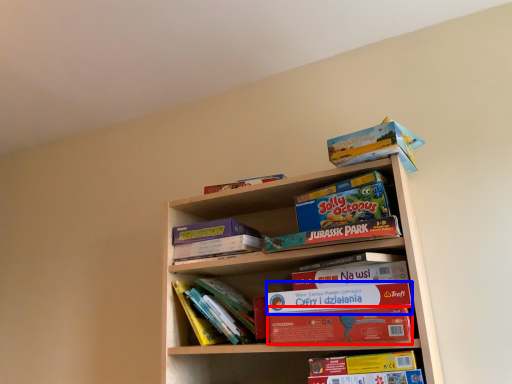
Question: Which point is further to the camera, paperback book (highlighted by a red box) or paperback book (highlighted by a blue box)?

Choices:
 (A) paperback book
 (B) paperback book

Answer: (B)